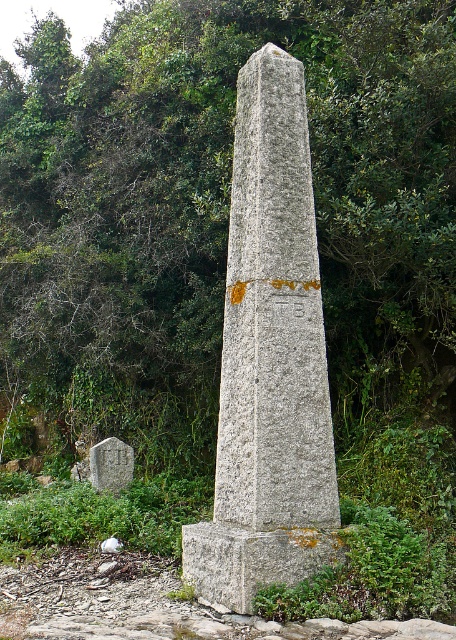
Question: Considering the relative positions of gray stone obelisk at center and gray concrete at lower left in the image provided, where is gray stone obelisk at center located with respect to gray concrete at lower left?

Choices:
 (A) above
 (B) below

Answer: (A)

Question: Which of the following is the closest to the observer?

Choices:
 (A) (257, 56)
 (B) (114, 442)

Answer: (A)

Question: Can you confirm if gray stone obelisk at center is positioned to the right of gray concrete at lower left?

Choices:
 (A) yes
 (B) no

Answer: (A)

Question: Does gray stone obelisk at center have a greater width compared to gray concrete at lower left?

Choices:
 (A) no
 (B) yes

Answer: (B)